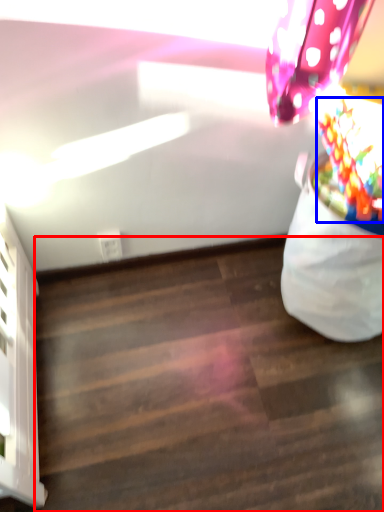
Question: Which of the following is the closest to the observer, stairwell (highlighted by a red box) or flower (highlighted by a blue box)?

Choices:
 (A) stairwell
 (B) flower

Answer: (B)